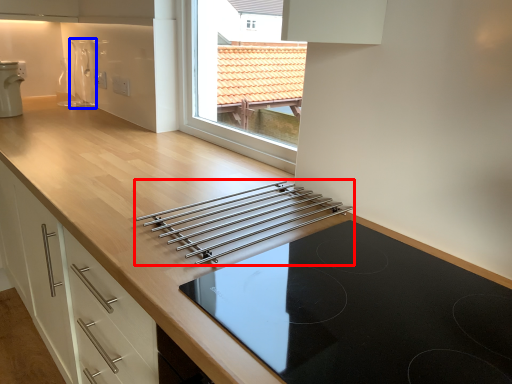
Question: Which of the following is the farthest to the observer, kitchen appliance (highlighted by a red box) or appliance (highlighted by a blue box)?

Choices:
 (A) kitchen appliance
 (B) appliance

Answer: (B)